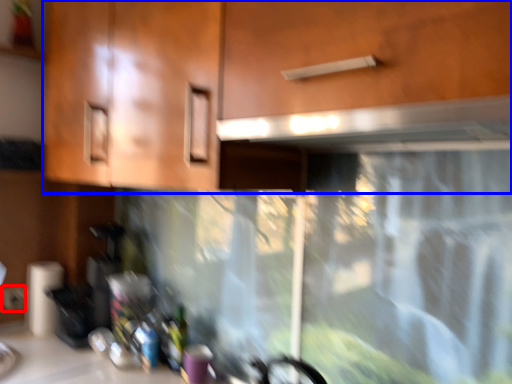
Question: Which object is closer to the camera taking this photo, electric outlet (highlighted by a red box) or cabinetry (highlighted by a blue box)?

Choices:
 (A) electric outlet
 (B) cabinetry

Answer: (B)